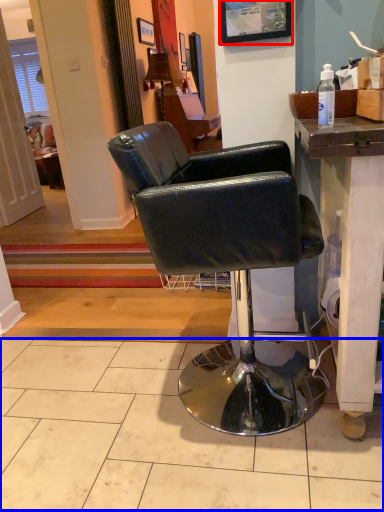
Question: Which object appears farthest to the camera in this image, picture frame (highlighted by a red box) or tile (highlighted by a blue box)?

Choices:
 (A) picture frame
 (B) tile

Answer: (A)